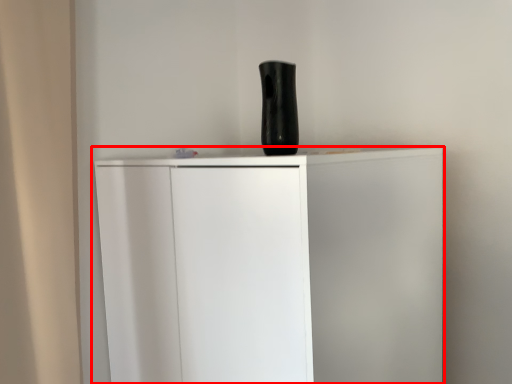
Question: From the image's perspective, where is cupboard (annotated by the red box) located relative to vase?

Choices:
 (A) above
 (B) below

Answer: (B)